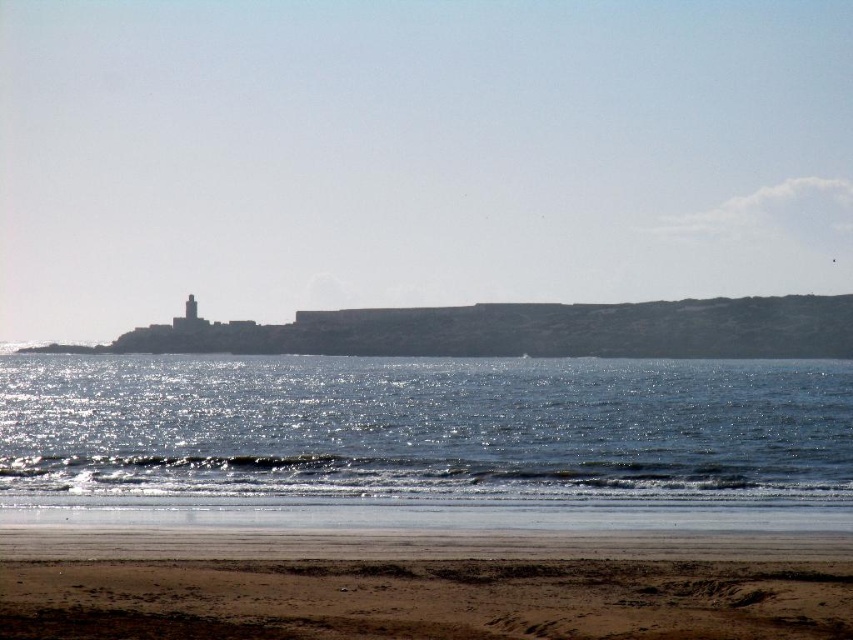
Question: Is glistening water at lower center positioned at the back of brown sandy beach at lower center?

Choices:
 (A) no
 (B) yes

Answer: (B)

Question: Which point is closer to the camera?

Choices:
 (A) (132, 596)
 (B) (515, 420)

Answer: (A)

Question: Which of the following is the closest to the observer?

Choices:
 (A) (463, 456)
 (B) (186, 589)

Answer: (B)

Question: Does glistening water at lower center appear over brown sandy beach at lower center?

Choices:
 (A) no
 (B) yes

Answer: (A)

Question: Can you confirm if glistening water at lower center is bigger than brown sandy beach at lower center?

Choices:
 (A) yes
 (B) no

Answer: (A)